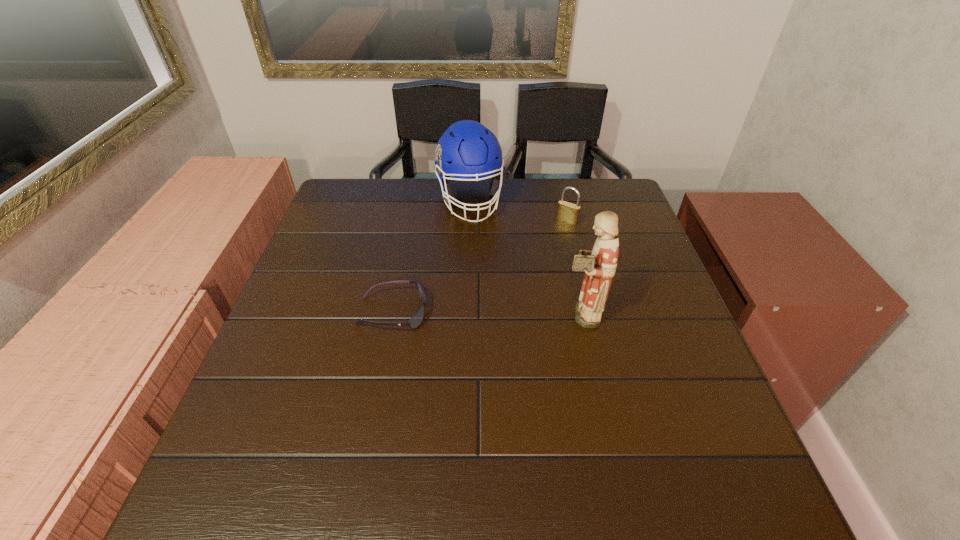
The image size is (960, 540). I want to click on object that is the second closest to the sunglasses, so click(x=599, y=265).

Locate an element on the screen. This screenshot has height=540, width=960. object that is the third closest to the third tallest object is located at coordinates (415, 321).